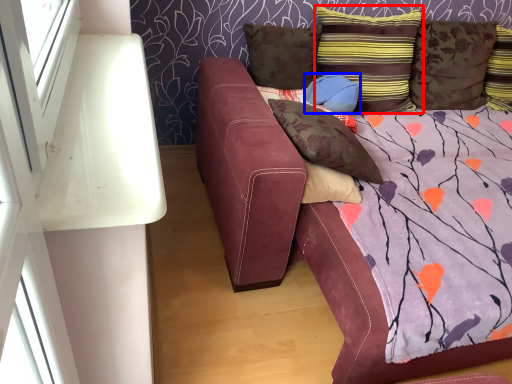
Question: Among these objects, which one is farthest to the camera, pillow (highlighted by a red box) or pillow (highlighted by a blue box)?

Choices:
 (A) pillow
 (B) pillow

Answer: (B)